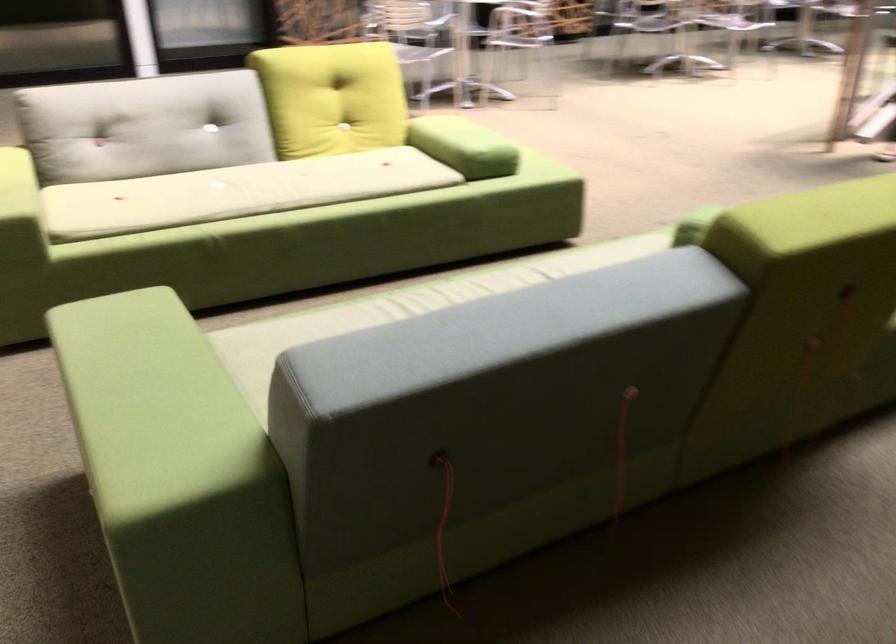
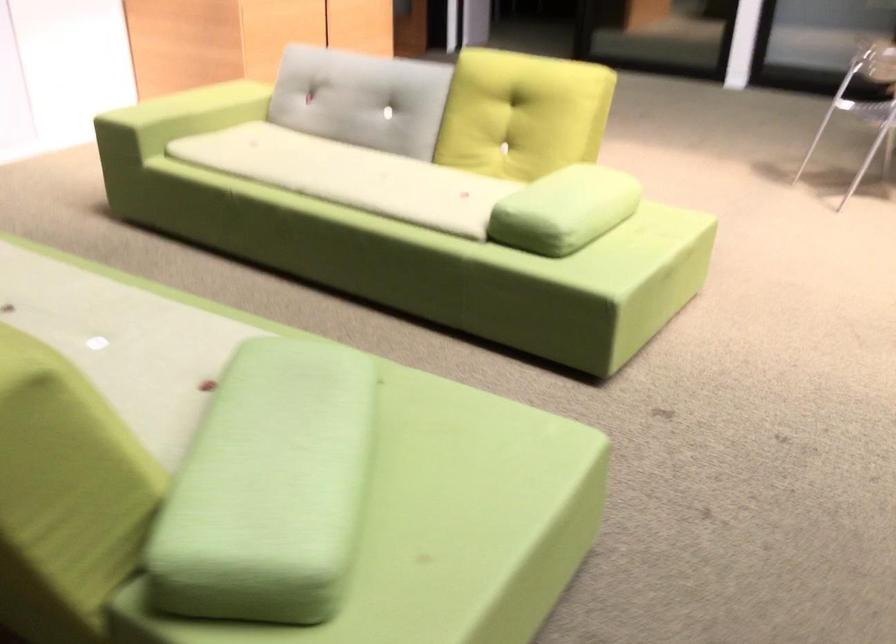
Where in the second image is the point corresponding to (x=463, y=295) from the first image?

(66, 290)